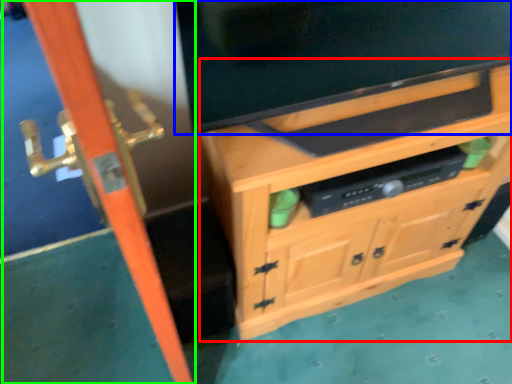
Question: Which object is positioned closest to cabinetry (highlighted by a red box)? Select from television (highlighted by a blue box) and screen door (highlighted by a green box).

Choices:
 (A) television
 (B) screen door

Answer: (A)